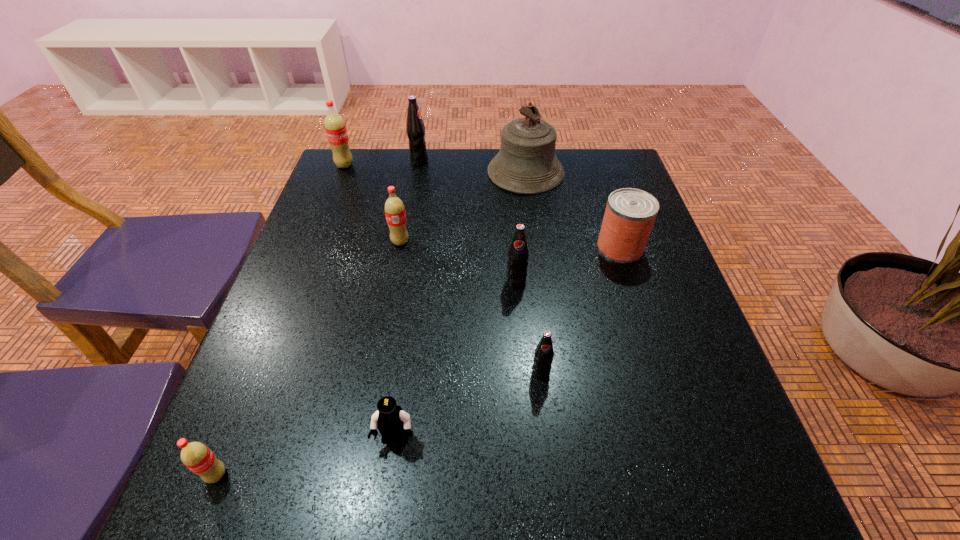
This screenshot has height=540, width=960. What are the coordinates of `bell` in the screenshot? It's located at (526, 163).

Find the location of a particular element. The height and width of the screenshot is (540, 960). the farthest black pop is located at coordinates (415, 128).

Locate an element on the screen. the leftmost black pop is located at coordinates (415, 128).

Locate an element on the screen. the farthest red soda is located at coordinates (335, 127).

Identify the location of the fourth farthest soda. This screenshot has width=960, height=540. (518, 254).

The height and width of the screenshot is (540, 960). In order to click on the fourth nearest object in this screenshot , I will do `click(518, 254)`.

Find the location of a particular element. The image size is (960, 540). the second nearest red soda is located at coordinates (394, 208).

The height and width of the screenshot is (540, 960). I want to click on the second smallest red soda, so click(394, 208).

The image size is (960, 540). Identify the location of can. (630, 213).

Locate an element on the screen. This screenshot has width=960, height=540. the nearest black pop is located at coordinates (543, 356).